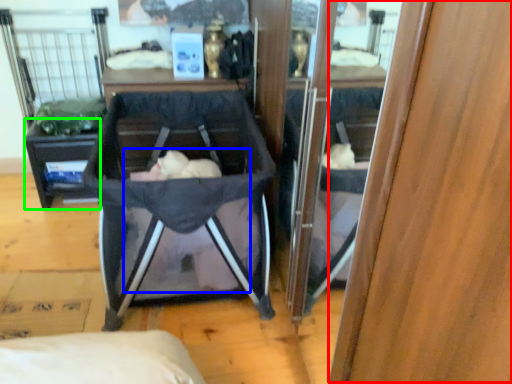
Question: Based on their relative distances, which object is nearer to wood (highlighted by a red box)? Choose from baby (highlighted by a blue box) and vanity (highlighted by a green box).

Choices:
 (A) baby
 (B) vanity

Answer: (A)